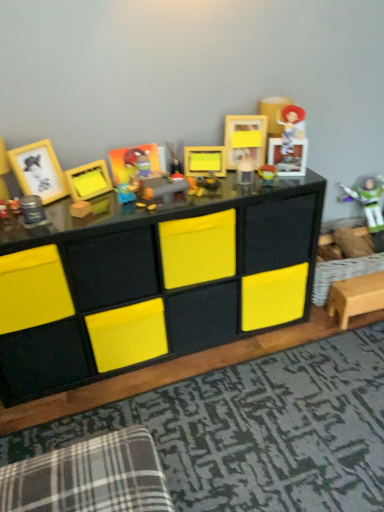
Question: Considering the relative sizes of matte plastic buzz lightyear at center, which is counted as the 3th toy, starting from the back, and black matte storage unit at center in the image provided, is matte plastic buzz lightyear at center, which is counted as the 3th toy, starting from the back, thinner than black matte storage unit at center?

Choices:
 (A) yes
 (B) no

Answer: (A)

Question: Is matte plastic buzz lightyear at center, which is the third toy in front-to-back order, closer to camera compared to black matte storage unit at center?

Choices:
 (A) yes
 (B) no

Answer: (B)

Question: Is matte plastic buzz lightyear at center, marked as the 3th toy in a right-to-left arrangement, next to black matte storage unit at center and touching it?

Choices:
 (A) no
 (B) yes

Answer: (A)

Question: From the image's perspective, is matte plastic buzz lightyear at center, which is counted as the 3th toy, starting from the back, on top of black matte storage unit at center?

Choices:
 (A) no
 (B) yes

Answer: (B)

Question: Can you confirm if matte plastic buzz lightyear at center, arranged as the 3th toy when viewed from the left, is bigger than black matte storage unit at center?

Choices:
 (A) yes
 (B) no

Answer: (B)

Question: Based on their positions, is matte yellow picture frame at upper center, which is counted as the 1th picture frame, starting from the right, located to the left or right of metallic silver canister at left, the first toy when ordered from front to back?

Choices:
 (A) right
 (B) left

Answer: (A)

Question: Does point pos(230,139) appear closer or farther from the camera than point pos(39,208)?

Choices:
 (A) farther
 (B) closer

Answer: (A)

Question: From a real-world perspective, is matte yellow picture frame at upper center, marked as the fifth picture frame in a left-to-right arrangement, positioned above or below metallic silver canister at left, the fifth toy in the right-to-left sequence?

Choices:
 (A) below
 (B) above

Answer: (B)

Question: Is matte yellow picture frame at upper center, marked as the fifth picture frame in a left-to-right arrangement, taller or shorter than metallic silver canister at left, the fifth toy in the right-to-left sequence?

Choices:
 (A) short
 (B) tall

Answer: (B)

Question: Does point (236, 241) appear closer or farther from the camera than point (158, 165)?

Choices:
 (A) closer
 (B) farther

Answer: (B)

Question: Would you say black matte storage unit at center is inside or outside matte plastic picture frame at center, which ranks as the third picture frame in left-to-right order?

Choices:
 (A) outside
 (B) inside

Answer: (A)

Question: From a real-world perspective, is black matte storage unit at center physically located above or below matte plastic picture frame at center, which ranks as the third picture frame in left-to-right order?

Choices:
 (A) above
 (B) below

Answer: (B)

Question: Considering the positions of black matte storage unit at center and matte plastic picture frame at center, which ranks as the third picture frame in left-to-right order, in the image, is black matte storage unit at center wider or thinner than matte plastic picture frame at center, which ranks as the third picture frame in left-to-right order,?

Choices:
 (A) wide
 (B) thin

Answer: (A)

Question: Is matte yellow plush toy at center, marked as the 2th toy in a left-to-right arrangement, taller or shorter than plaid fabric swivel chair at lower left?

Choices:
 (A) short
 (B) tall

Answer: (A)

Question: Is matte yellow plush toy at center, marked as the 2th toy in a left-to-right arrangement, inside or outside of plaid fabric swivel chair at lower left?

Choices:
 (A) outside
 (B) inside

Answer: (A)